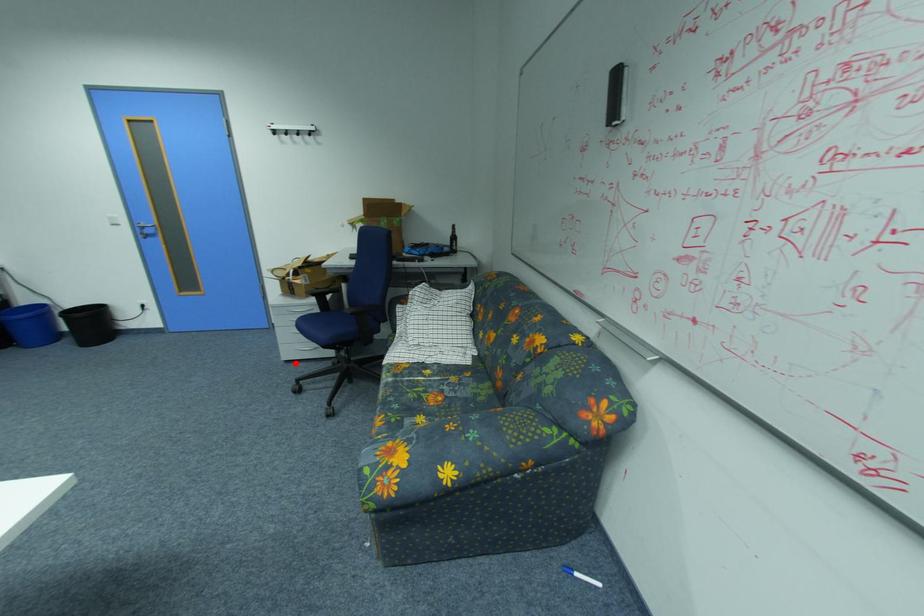
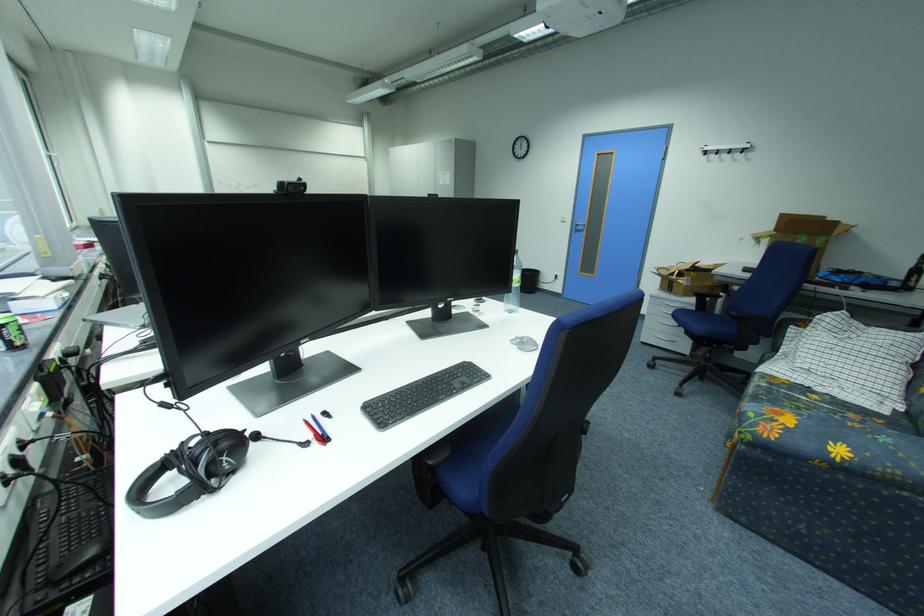
In the second image, find the point that corresponds to the highlighted location in the first image.

(651, 344)